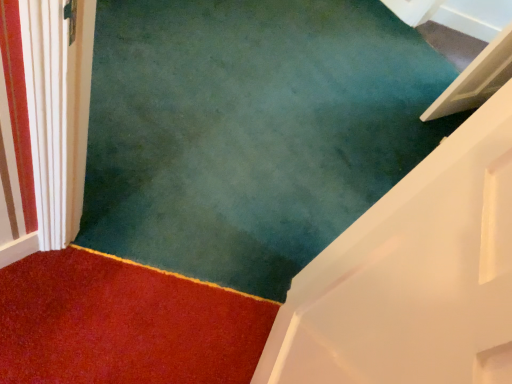
Where is `white glossy door at upper right`? white glossy door at upper right is located at coordinates (413, 276).

The height and width of the screenshot is (384, 512). Describe the element at coordinates (413, 276) in the screenshot. I see `white glossy door at upper right` at that location.

What is the approximate width of white glossy door at upper right?

It is 3.35 inches.

I want to click on white glossy door at upper right, so click(x=413, y=276).